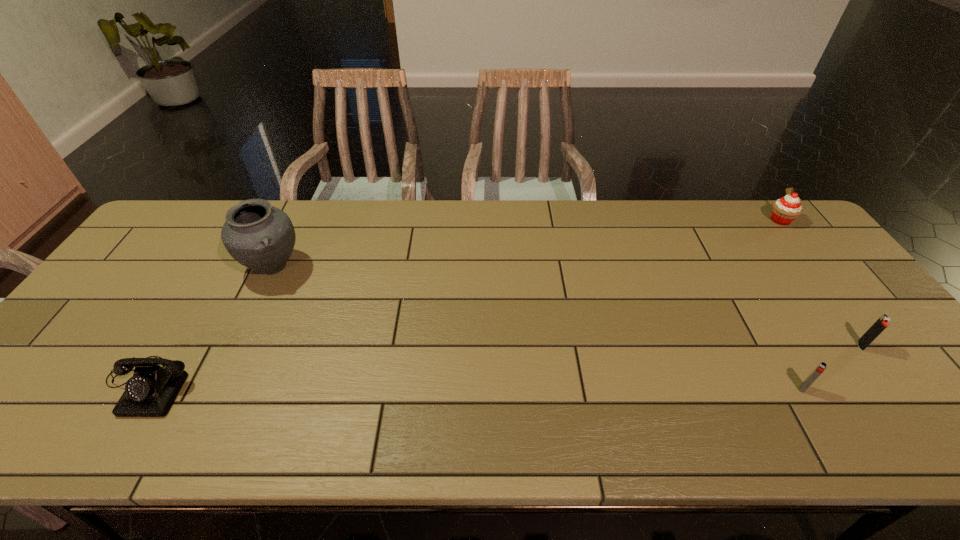
At what (x,y) coordinates should I click in order to perform the action: click on free space between the telephone and the farthest object. Please return your answer as a coordinate pair (x, y). Looking at the image, I should click on (464, 302).

Where is `object that is the third nearest to the cupcake`? The image size is (960, 540). object that is the third nearest to the cupcake is located at coordinates (257, 235).

Image resolution: width=960 pixels, height=540 pixels. Identify the location of the fourth closest object to the third farthest object. (151, 392).